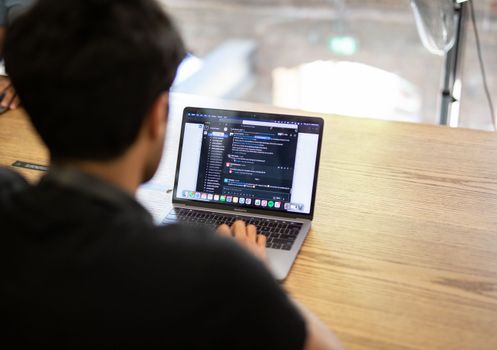
Locate an element on the screen. The image size is (497, 350). laptop screen is located at coordinates (239, 156).